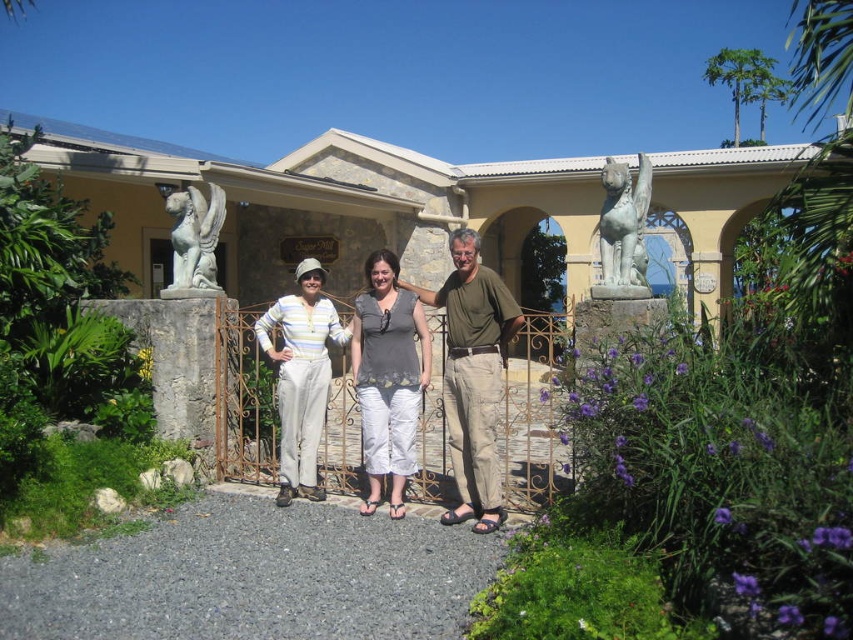
Between bronze statue at upper right and stone statue at left, which one is positioned lower?

Positioned lower is stone statue at left.

Does bronze statue at upper right have a greater height compared to stone statue at left?

Yes, bronze statue at upper right is taller than stone statue at left.

I want to click on bronze statue at upper right, so click(624, 230).

I want to click on bronze statue at upper right, so click(624, 230).

Describe the element at coordinates (387, 378) in the screenshot. The height and width of the screenshot is (640, 853). I see `gray cotton shirt at center` at that location.

Is gray cotton shirt at center to the left of bronze statue at upper right from the viewer's perspective?

Indeed, gray cotton shirt at center is positioned on the left side of bronze statue at upper right.

Is point (416, 372) positioned behind point (639, 240)?

Yes, it is behind point (639, 240).

Where is `gray cotton shirt at center`? The height and width of the screenshot is (640, 853). gray cotton shirt at center is located at coordinates [387, 378].

Does point (254, 330) come in front of point (178, 234)?

Yes, point (254, 330) is in front of point (178, 234).

Can you confirm if striped fabric pants at center is bigger than stone statue at left?

Yes.

Does point (318, 433) lie in front of point (173, 284)?

Yes, point (318, 433) is in front of point (173, 284).

Where is `striped fabric pants at center`? This screenshot has height=640, width=853. striped fabric pants at center is located at coordinates (300, 376).